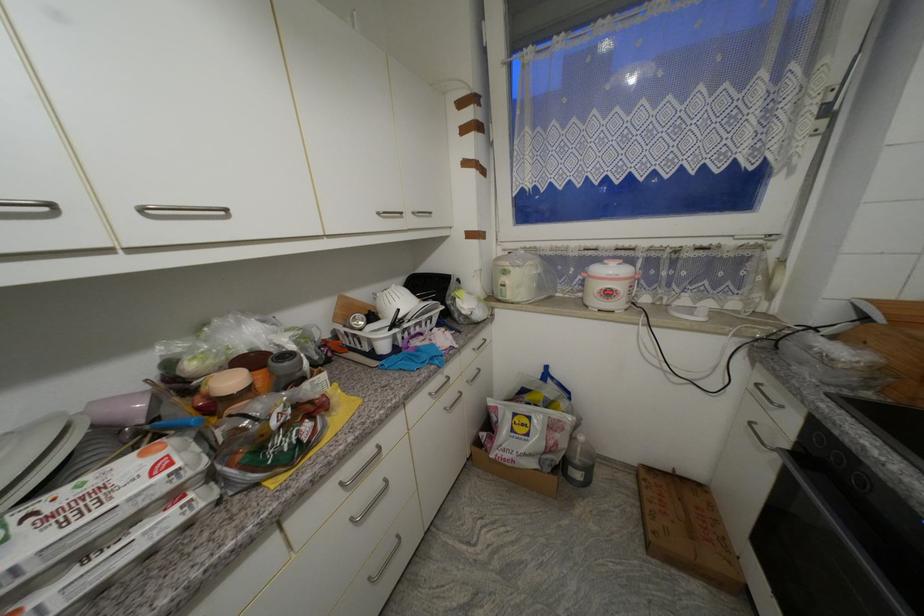
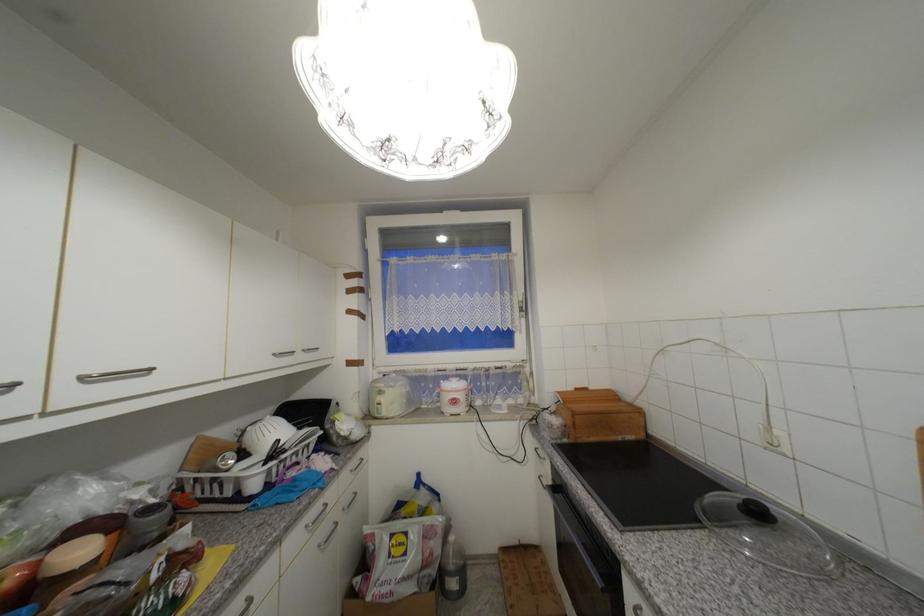
Where in the second image is the point corresponding to (426,325) from the first image?

(301, 454)